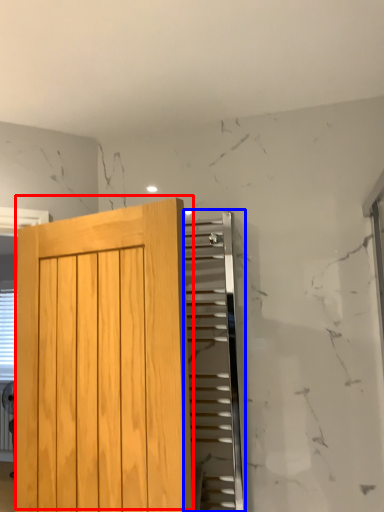
Question: Which of the following is the closest to the observer, door (highlighted by a red box) or elevator (highlighted by a blue box)?

Choices:
 (A) door
 (B) elevator

Answer: (A)